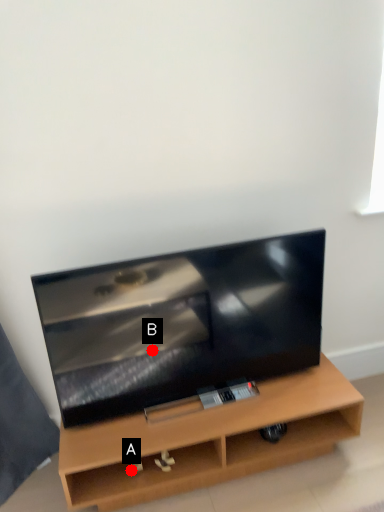
Question: Two points are circled on the image, labeled by A and B beside each circle. Which point is further to the camera?

Choices:
 (A) A is further
 (B) B is further

Answer: (A)